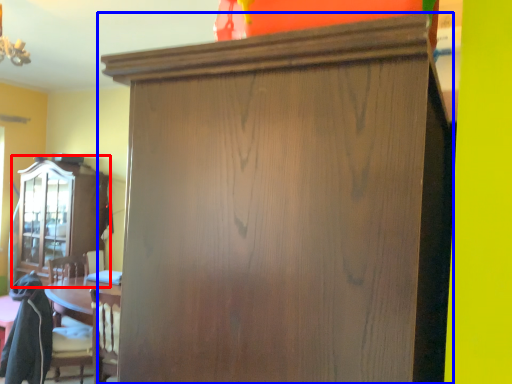
Question: Which object appears closest to the camera in this image, cabinetry (highlighted by a red box) or cupboard (highlighted by a blue box)?

Choices:
 (A) cabinetry
 (B) cupboard

Answer: (B)